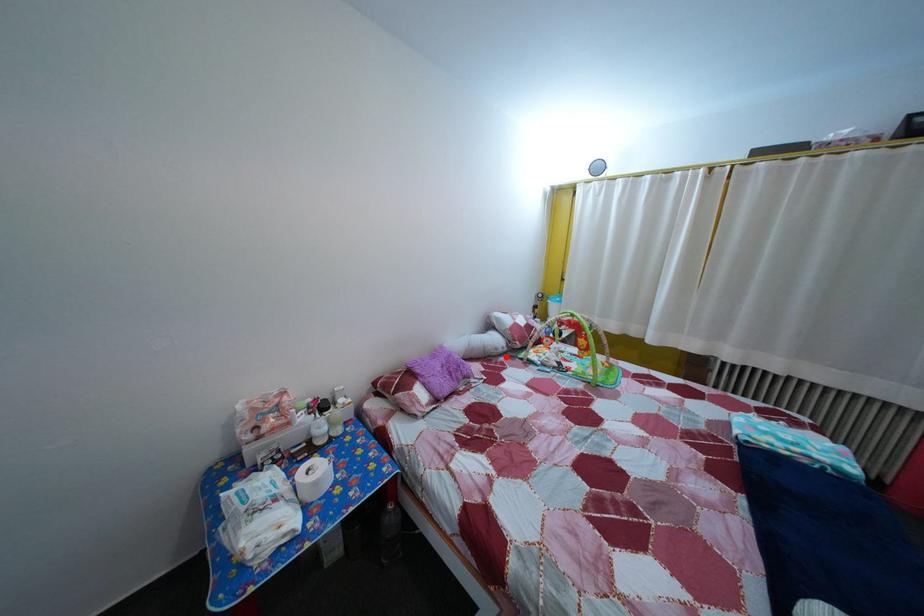
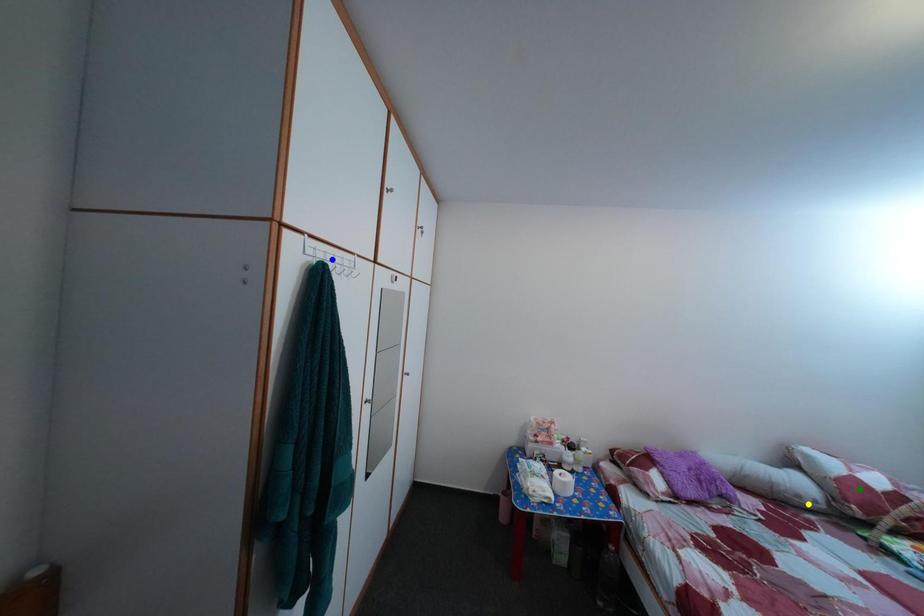
Question: I am providing you with two images of the same scene from different viewpoints. A red point is marked on the first image. You are given multiple points on the second image. Which spot in image 2 lines up with the point in image 1?

Choices:
 (A) yellow point
 (B) green point
 (C) blue point

Answer: (A)